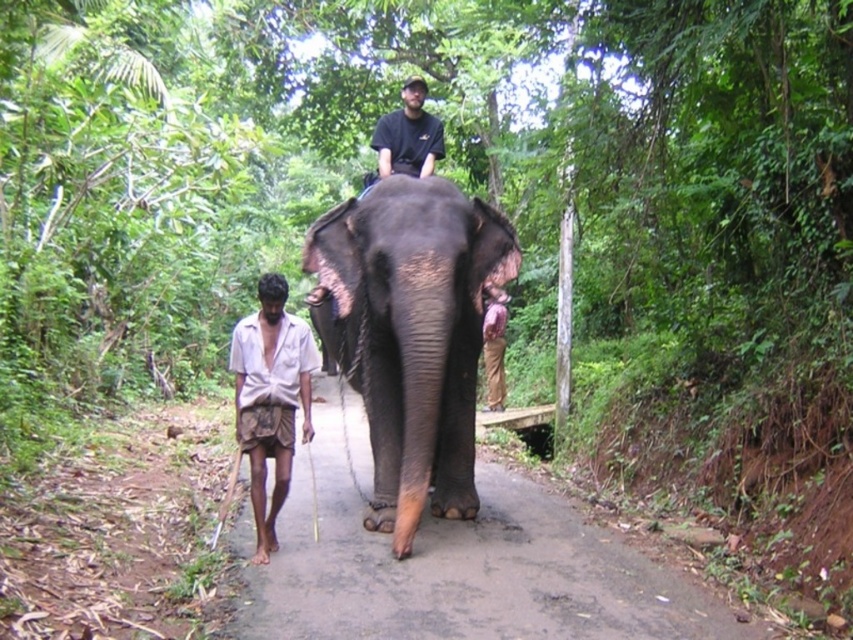
You are a hiker who wants to take a photo of the white clothed man at left and the black matte shirt at center. Which one should you aim your camera at first if you want to capture both in one shot?

The white clothed man at left is below the black matte shirt at center, so you should aim your camera at the black matte shirt at center first to ensure both are in frame.

Consider the image. You are standing at the entrance of the forest path and want to locate the dark gray textured elephant at center. According to the coordinates given, where would you find it?

The dark gray textured elephant at center is located at the coordinates point [410,333].

Consider the image. You are a hiker trying to follow the brown dirt path at center while avoiding the dark gray textured elephant at center. Which direction should you move to stay on the path and avoid the elephant?

The brown dirt path at center is in front of the dark gray textured elephant at center, so you should move forward along the path to stay ahead of the elephant and remain on the path.